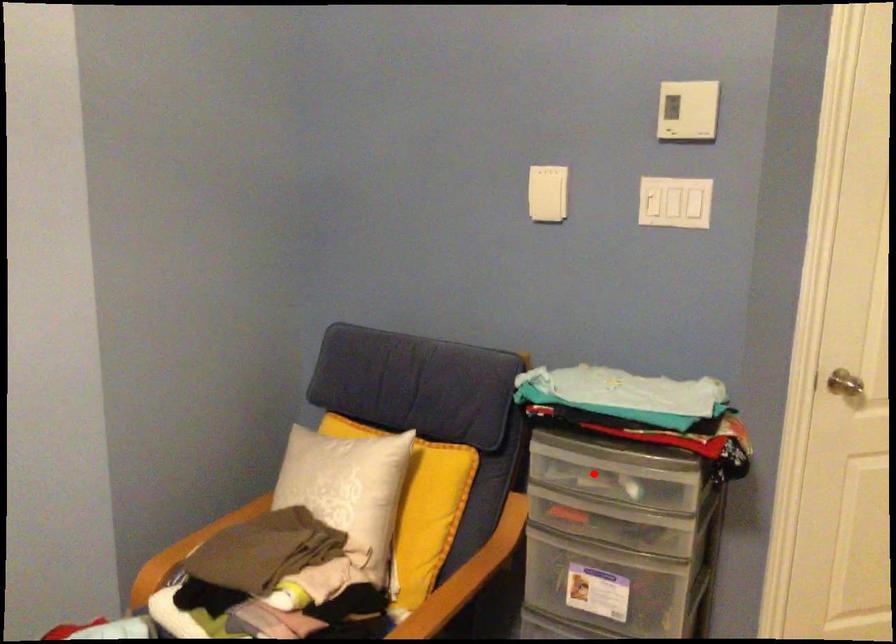
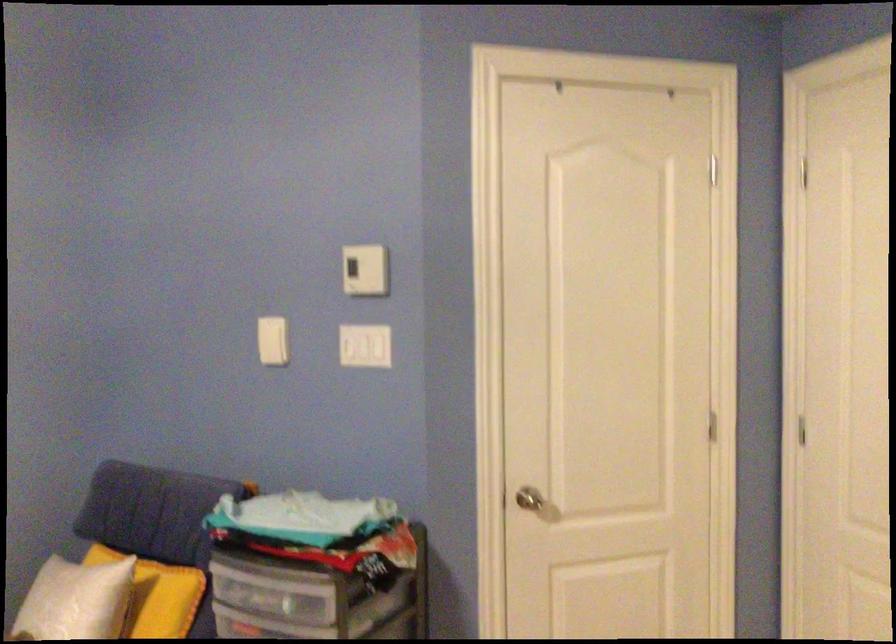
Question: I am providing you with two images of the same scene from different viewpoints. In image1, a red point is highlighted. Considering the same 3D point in image2, which of the following is correct?

Choices:
 (A) It is closer
 (B) It is farther

Answer: (B)